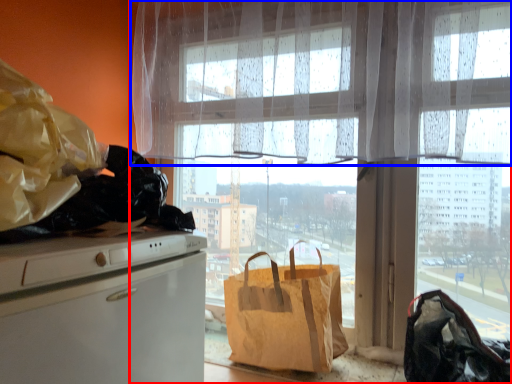
Question: Which object appears farthest to the camera in this image, window (highlighted by a red box) or curtain (highlighted by a blue box)?

Choices:
 (A) window
 (B) curtain

Answer: (A)